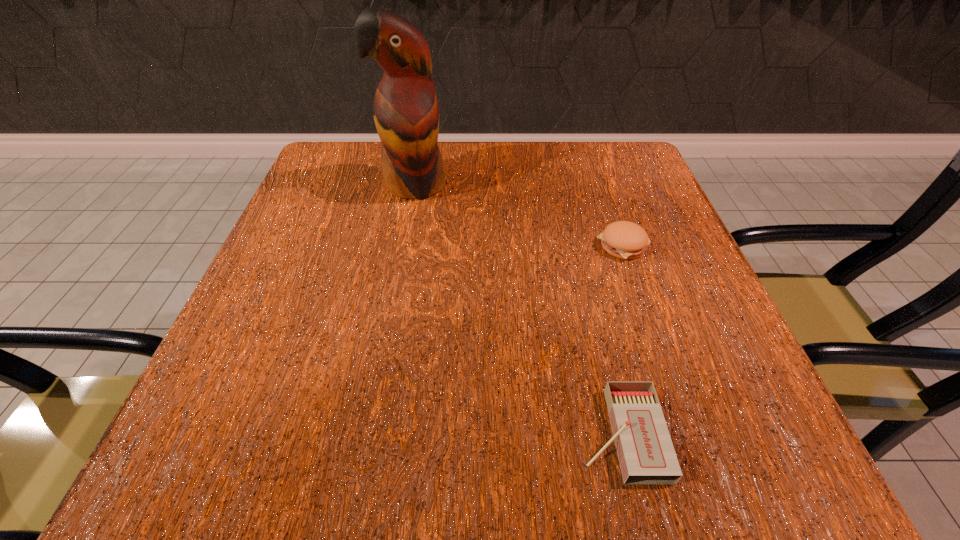
Locate an element on the screen. The height and width of the screenshot is (540, 960). object that is at the near edge is located at coordinates [x=646, y=454].

This screenshot has width=960, height=540. I want to click on object that is at the left edge, so click(406, 113).

The width and height of the screenshot is (960, 540). I want to click on patty that is positioned at the right edge, so click(x=626, y=240).

At what (x,y) coordinates should I click in order to perform the action: click on matchbox present at the right edge. Please return your answer as a coordinate pair (x, y). Looking at the image, I should click on (646, 454).

Locate an element on the screen. Image resolution: width=960 pixels, height=540 pixels. object positioned at the far left corner is located at coordinates (406, 113).

You are a GUI agent. You are given a task and a screenshot of the screen. Output one action in this format:
    pyautogui.click(x=<x>, y=<y>)
    Task: Click on the object situated at the near right corner
    This screenshot has width=960, height=540.
    Given the screenshot: What is the action you would take?
    pyautogui.click(x=646, y=454)

In the image, there is a desktop. Where is `vacant space at the far edge`? The width and height of the screenshot is (960, 540). vacant space at the far edge is located at coordinates (463, 177).

Identify the location of vacant space at the near edge. This screenshot has width=960, height=540. (444, 430).

This screenshot has height=540, width=960. In the image, there is a desktop. What are the coordinates of `vacant space at the left edge` in the screenshot? It's located at (316, 261).

The width and height of the screenshot is (960, 540). In the image, there is a desktop. In order to click on vacant area at the right edge in this screenshot , I will do `click(646, 285)`.